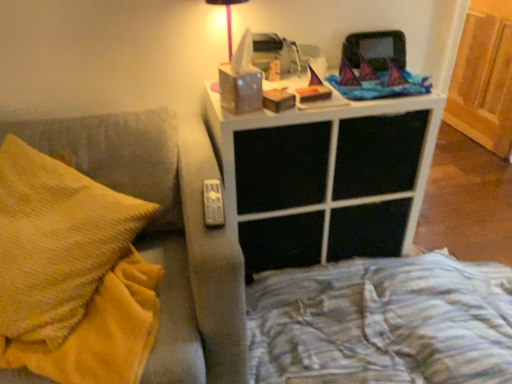
Question: Is matte white tissue box at upper center facing towards white matte nightstand at upper center?

Choices:
 (A) yes
 (B) no

Answer: (B)

Question: Considering the relative sizes of matte white tissue box at upper center and white matte nightstand at upper center in the image provided, is matte white tissue box at upper center wider than white matte nightstand at upper center?

Choices:
 (A) yes
 (B) no

Answer: (B)

Question: Is matte white tissue box at upper center facing away from white matte nightstand at upper center?

Choices:
 (A) yes
 (B) no

Answer: (B)

Question: Does matte white tissue box at upper center have a larger size compared to white matte nightstand at upper center?

Choices:
 (A) no
 (B) yes

Answer: (A)

Question: From a real-world perspective, is matte white tissue box at upper center on white matte nightstand at upper center?

Choices:
 (A) no
 (B) yes

Answer: (B)

Question: Is matte white tissue box at upper center not within white matte nightstand at upper center?

Choices:
 (A) yes
 (B) no

Answer: (A)

Question: Is suede-like gray couch armrest at left inside matte white tissue box at upper center?

Choices:
 (A) yes
 (B) no

Answer: (B)

Question: Is matte white tissue box at upper center behind suede-like gray couch armrest at left?

Choices:
 (A) no
 (B) yes

Answer: (B)

Question: From the image's perspective, is matte white tissue box at upper center under suede-like gray couch armrest at left?

Choices:
 (A) no
 (B) yes

Answer: (A)

Question: From a real-world perspective, is matte white tissue box at upper center physically above suede-like gray couch armrest at left?

Choices:
 (A) yes
 (B) no

Answer: (A)

Question: Does matte white tissue box at upper center have a lesser height compared to suede-like gray couch armrest at left?

Choices:
 (A) yes
 (B) no

Answer: (A)

Question: Can you confirm if matte white tissue box at upper center is positioned to the left of suede-like gray couch armrest at left?

Choices:
 (A) yes
 (B) no

Answer: (B)

Question: Can you confirm if white matte nightstand at upper center is positioned to the right of wooden bed frame at lower right?

Choices:
 (A) no
 (B) yes

Answer: (A)